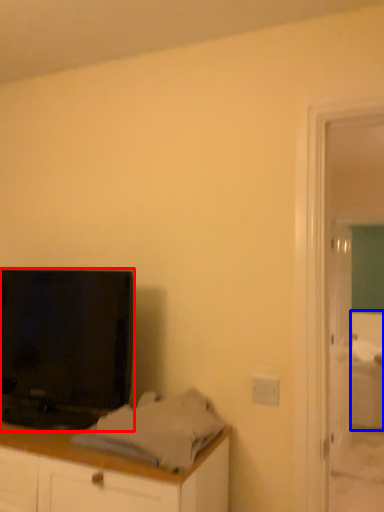
Question: Which object appears closest to the camera in this image, television (highlighted by a red box) or bed (highlighted by a blue box)?

Choices:
 (A) television
 (B) bed

Answer: (A)